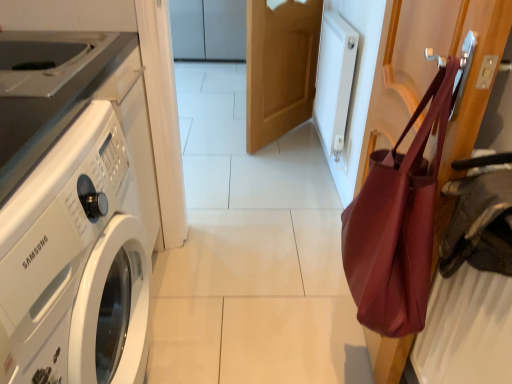
Question: Considering their positions, is light brown wood door at center located in front of or behind white glossy washing machine at left?

Choices:
 (A) behind
 (B) front

Answer: (A)

Question: From the image's perspective, is light brown wood door at center positioned above or below white glossy washing machine at left?

Choices:
 (A) above
 (B) below

Answer: (A)

Question: Considering the real-world distances, which object is farthest from the white glossy washing machine at left?

Choices:
 (A) light brown wood door at center
 (B) matte burgundy tote bag at right

Answer: (A)

Question: Estimate the real-world distances between objects in this image. Which object is closer to the white glossy washing machine at left?

Choices:
 (A) light brown wood door at center
 (B) matte burgundy tote bag at right

Answer: (B)